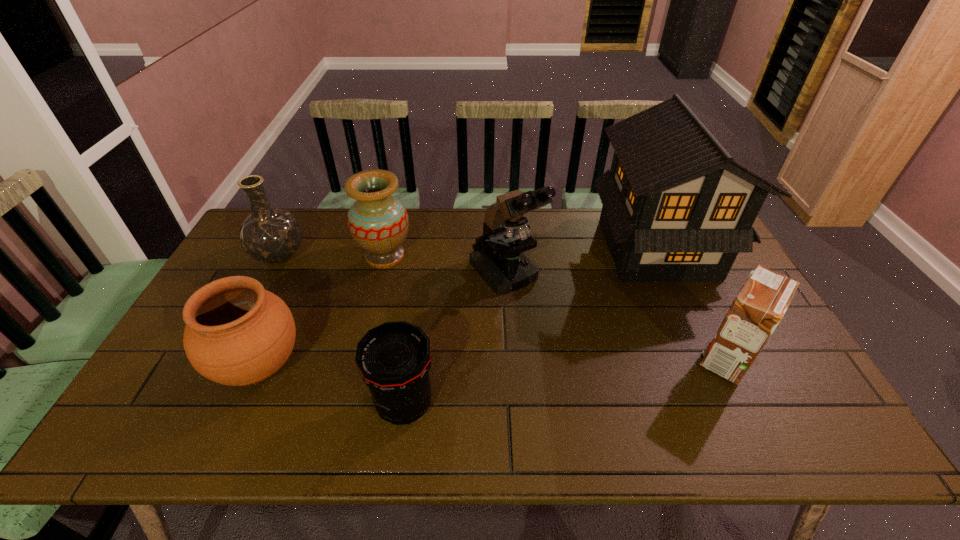
Locate an element on the screen. free space that satisfies the following two spatial constraints: 1. on the front side of the pottery; 2. on the right side of the telephoto lens is located at coordinates (243, 404).